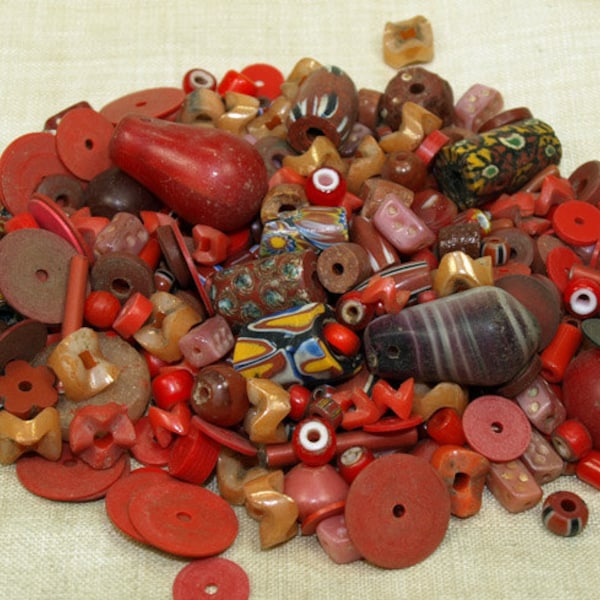
Where is `light beige background`? Image resolution: width=600 pixels, height=600 pixels. light beige background is located at coordinates (70, 48), (541, 66).